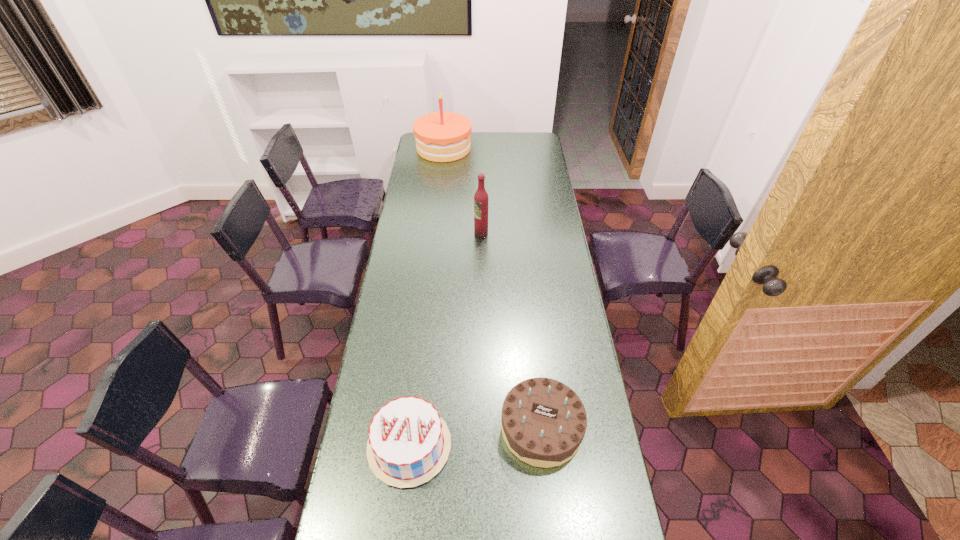
The image size is (960, 540). I want to click on object that stands as the third closest to the farthest birthday cake, so click(409, 443).

This screenshot has height=540, width=960. In order to click on birthday cake that is the second closest to the tallest birthday cake in this screenshot , I will do `click(409, 443)`.

This screenshot has width=960, height=540. What are the coordinates of `birthday cake that is the closest to the tallest birthday cake` in the screenshot? It's located at (543, 422).